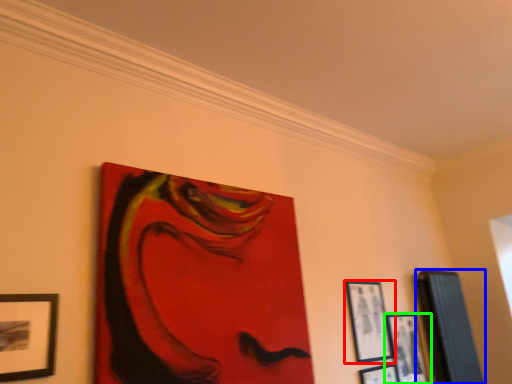
Question: Considering the real-world distances, which object is farthest from picture frame (highlighted by a red box)? picture frame (highlighted by a blue box) or picture frame (highlighted by a green box)?

Choices:
 (A) picture frame
 (B) picture frame

Answer: (A)